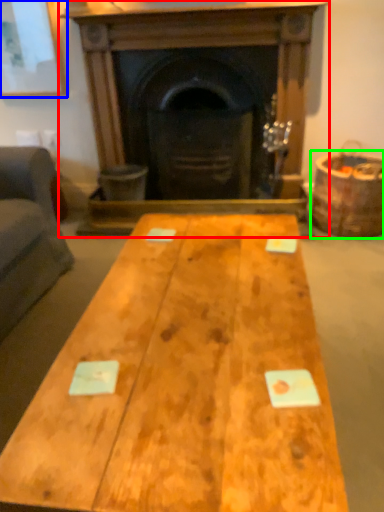
Question: Considering the real-world distances, which object is closest to fireplace (highlighted by a red box)? picture frame (highlighted by a blue box) or barrel (highlighted by a green box).

Choices:
 (A) picture frame
 (B) barrel

Answer: (B)